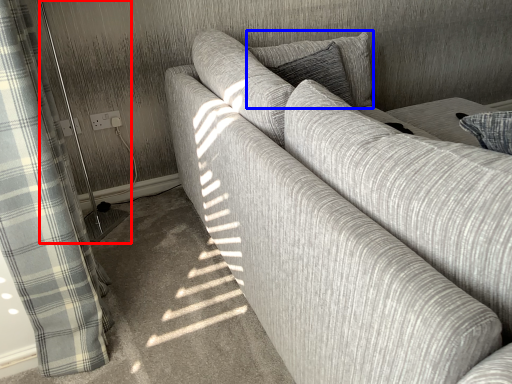
Question: Among these objects, which one is farthest to the camera, screen door (highlighted by a red box) or pillow (highlighted by a blue box)?

Choices:
 (A) screen door
 (B) pillow

Answer: (B)